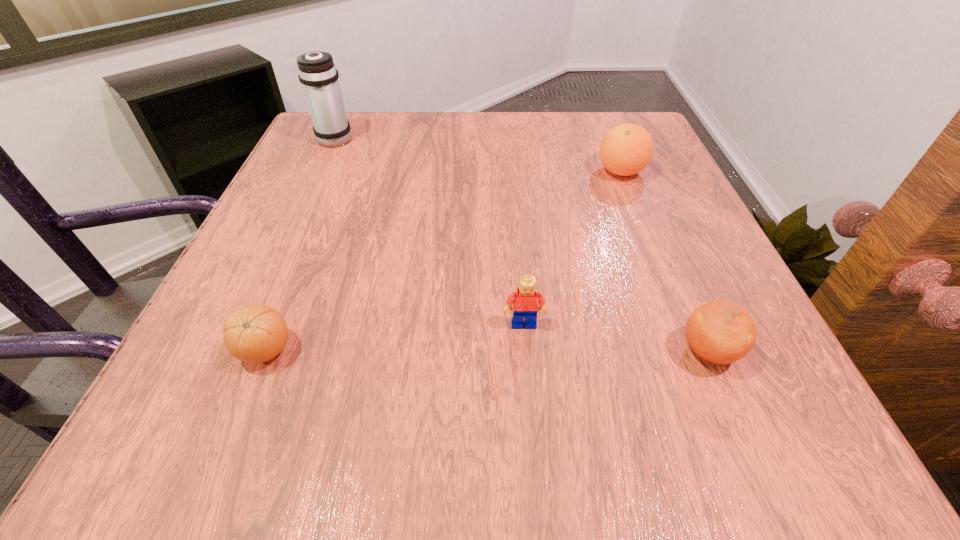
The width and height of the screenshot is (960, 540). Identify the location of the tallest object. (317, 73).

At what (x,y) coordinates should I click in order to perform the action: click on the farthest object. Please return your answer as a coordinate pair (x, y). Image resolution: width=960 pixels, height=540 pixels. Looking at the image, I should click on (317, 73).

Where is `the fourth nearest object`? This screenshot has width=960, height=540. the fourth nearest object is located at coordinates (626, 149).

Image resolution: width=960 pixels, height=540 pixels. Identify the location of the third object from left to right. (524, 301).

Where is `the shortest object`? This screenshot has height=540, width=960. the shortest object is located at coordinates (256, 333).

This screenshot has height=540, width=960. I want to click on the shortest orange, so click(256, 333).

You are a GUI agent. You are given a task and a screenshot of the screen. Output one action in this format:
    pyautogui.click(x=<x>, y=<y>)
    Task: Click on the free space located on the side with the handle of the tallest object
    
    Given the screenshot: What is the action you would take?
    pyautogui.click(x=348, y=111)

Where is `free location located 0.110m on the left of the second farthest object`? free location located 0.110m on the left of the second farthest object is located at coordinates click(x=544, y=171).

The height and width of the screenshot is (540, 960). Find the location of `free space located on the front-facing side of the third object from right to left`. free space located on the front-facing side of the third object from right to left is located at coordinates pos(533,435).

The height and width of the screenshot is (540, 960). In order to click on vacant space located on the right of the shortest object in this screenshot , I will do `click(568, 350)`.